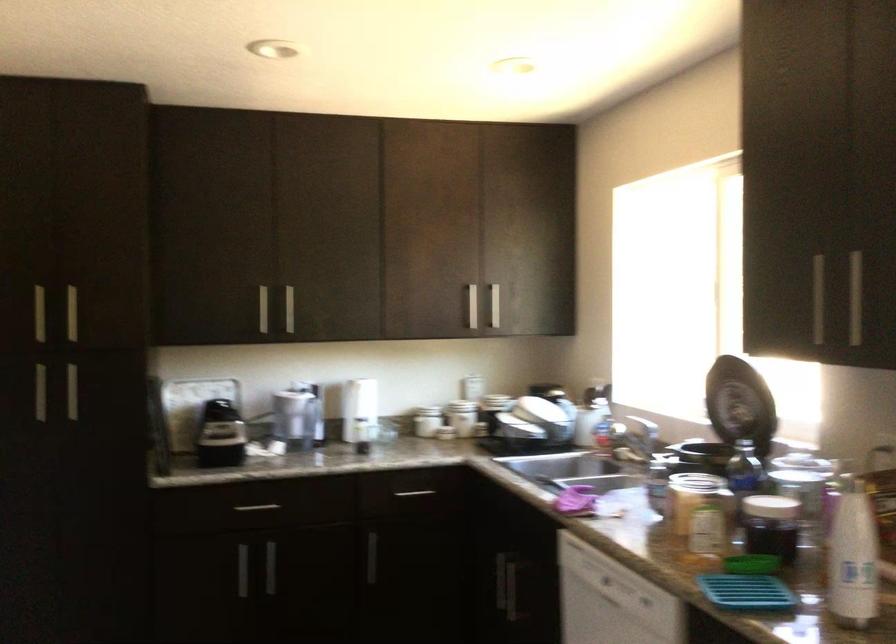
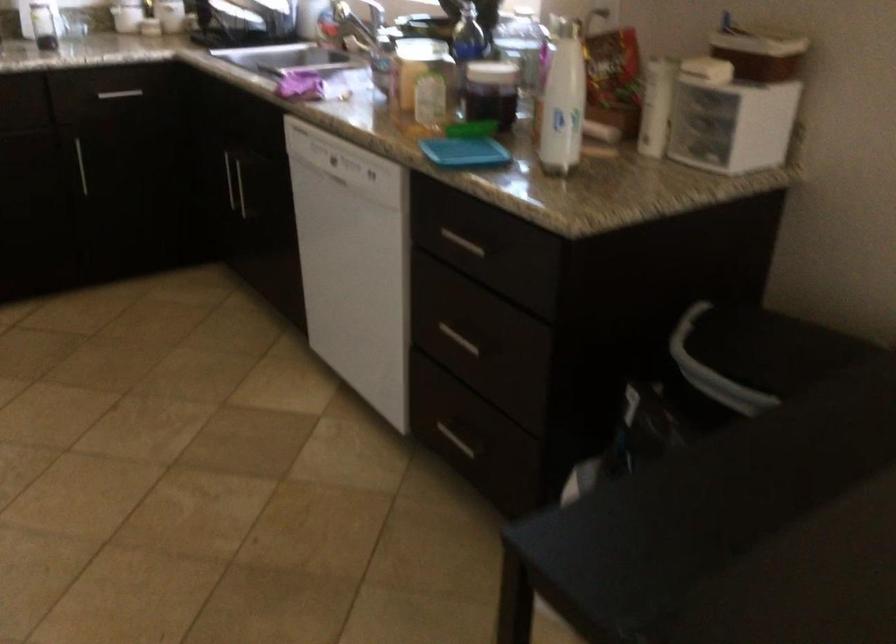
Based on the continuous images, in which direction is the camera rotating?

The rotation direction of the camera is right-down.